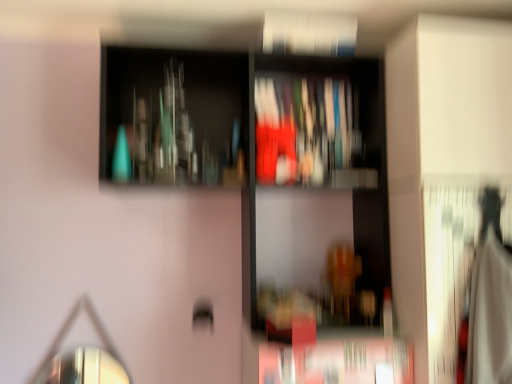
Question: Which direction should I rotate to face matte plastic book at center, the 1th book in the back-to-front sequence, — up or down?

Choices:
 (A) down
 (B) up

Answer: (B)

Question: From the image's perspective, is matte plastic book at center, which is the second book from top to bottom, located above matte glass bottles at upper center?

Choices:
 (A) no
 (B) yes

Answer: (B)

Question: From a real-world perspective, is matte plastic book at center, the 2th book in the front-to-back sequence, beneath matte glass bottles at upper center?

Choices:
 (A) no
 (B) yes

Answer: (A)

Question: Considering the relative sizes of matte plastic book at center, the 1th book in the back-to-front sequence, and matte glass bottles at upper center in the image provided, is matte plastic book at center, the 1th book in the back-to-front sequence, smaller than matte glass bottles at upper center?

Choices:
 (A) no
 (B) yes

Answer: (B)

Question: Is matte plastic book at center, which is the second book from top to bottom, far away from matte glass bottles at upper center?

Choices:
 (A) no
 (B) yes

Answer: (A)

Question: Is matte plastic book at center, the 2th book in the front-to-back sequence, directly adjacent to matte glass bottles at upper center?

Choices:
 (A) no
 (B) yes

Answer: (A)

Question: Is matte plastic book at center, the 2th book in the front-to-back sequence, to the right of matte glass bottles at upper center from the viewer's perspective?

Choices:
 (A) yes
 (B) no

Answer: (A)

Question: Does white paper book at upper center, acting as the first book starting from the front, have a lesser width compared to matte plastic book at center, the 2th book in the front-to-back sequence?

Choices:
 (A) no
 (B) yes

Answer: (B)

Question: Can you confirm if white paper book at upper center, the second book viewed from the back, is positioned to the right of matte plastic book at center, acting as the first book starting from the bottom?

Choices:
 (A) no
 (B) yes

Answer: (A)

Question: From a real-world perspective, does white paper book at upper center, the 1th book positioned from the top, sit lower than matte plastic book at center, the 1th book in the back-to-front sequence?

Choices:
 (A) yes
 (B) no

Answer: (B)

Question: Does white paper book at upper center, the 2th book positioned from the bottom, have a lesser height compared to matte plastic book at center, the 2th book in the front-to-back sequence?

Choices:
 (A) yes
 (B) no

Answer: (A)

Question: Is white paper book at upper center, the 2th book positioned from the bottom, smaller than matte plastic book at center, which is the second book from top to bottom?

Choices:
 (A) no
 (B) yes

Answer: (B)

Question: Does white paper book at upper center, the second book viewed from the back, have a greater height compared to matte plastic book at center, which is the second book from top to bottom?

Choices:
 (A) yes
 (B) no

Answer: (B)

Question: Is matte plastic book at center, the 2th book in the front-to-back sequence, not close to shiny metallic mirror at lower left?

Choices:
 (A) no
 (B) yes

Answer: (B)